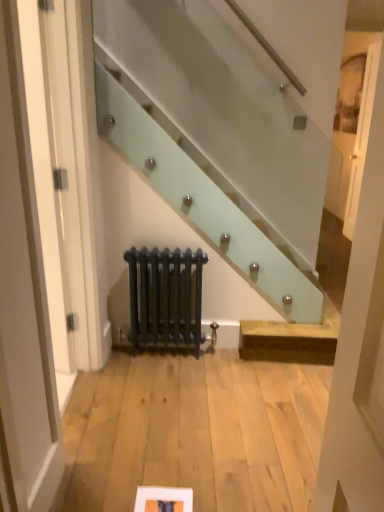
Question: From the image's perspective, relative to matte white picture frame at lower center, is matte black radiator at center above or below?

Choices:
 (A) below
 (B) above

Answer: (B)

Question: Would you say matte black radiator at center is inside or outside matte white picture frame at lower center?

Choices:
 (A) inside
 (B) outside

Answer: (B)

Question: Which object is the closest to the matte white picture frame at lower center?

Choices:
 (A) matte black radiator at center
 (B) white glossy door at upper right

Answer: (A)

Question: Which object is positioned closest to the matte white picture frame at lower center?

Choices:
 (A) matte black radiator at center
 (B) white glossy door at upper right

Answer: (A)